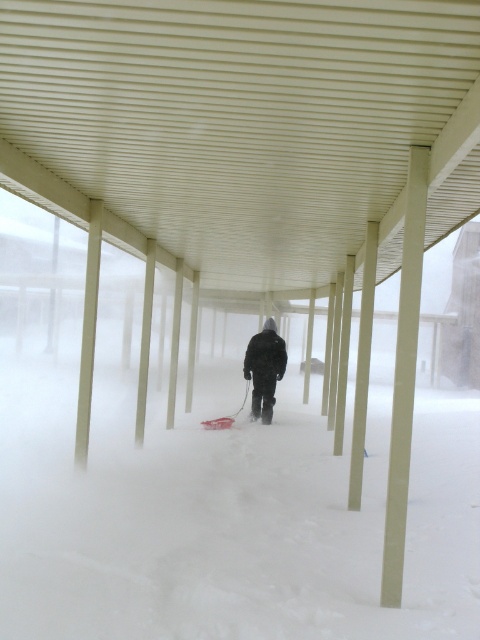
Question: Which object is closer to the camera taking this photo?

Choices:
 (A) dark matte jacket at center
 (B) white corrugated metal canopy at center
 (C) white fluffy snow at center

Answer: (C)

Question: Based on their relative distances, which object is nearer to the white corrugated metal canopy at center?

Choices:
 (A) dark matte jacket at center
 (B) white fluffy snow at center

Answer: (B)

Question: Does white fluffy snow at center have a larger size compared to dark matte jacket at center?

Choices:
 (A) yes
 (B) no

Answer: (A)

Question: Considering the relative positions of white corrugated metal canopy at center and dark matte jacket at center in the image provided, where is white corrugated metal canopy at center located with respect to dark matte jacket at center?

Choices:
 (A) left
 (B) right

Answer: (B)

Question: Which of the following is the closest to the observer?

Choices:
 (A) (37, 100)
 (B) (364, 586)
 (C) (269, 410)

Answer: (A)

Question: Does white fluffy snow at center come behind dark matte jacket at center?

Choices:
 (A) no
 (B) yes

Answer: (A)